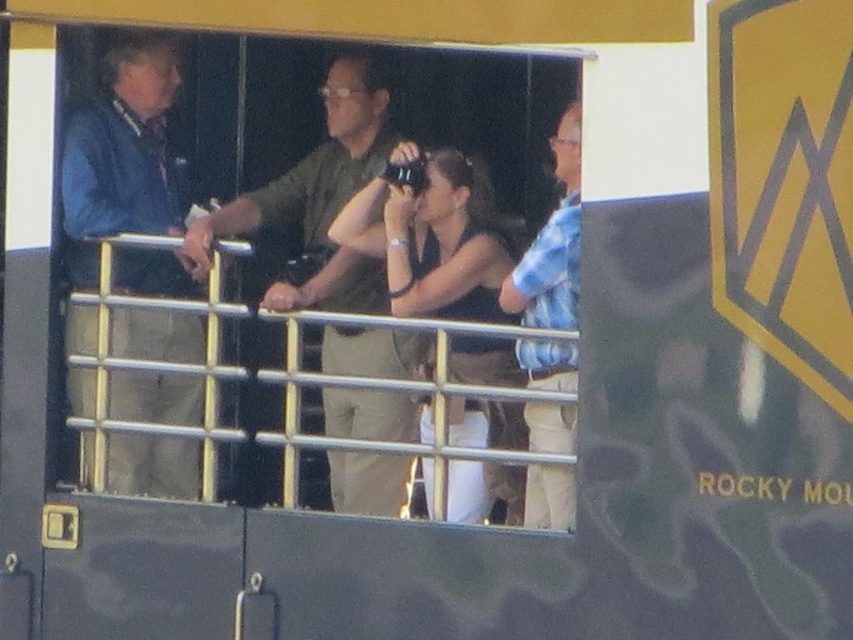
You are a person standing on the balcony and want to look through the transparent glass at center without disturbing the blue fabric jacket at left. Which object should you move closer to?

You should move closer to the transparent glass at center because it is already closer to the viewer than the blue fabric jacket at left, so you can reach it without needing to move the jacket.

You are standing on a balcony with a group of people. You see a green matte shirt at center and a black matte tank top at center. Which person is positioned to the left of the other?

The green matte shirt at center is to the left of the black matte tank top at center.

You are a photographer positioned behind the group and want to capture a clear shot of the black matte tank top at center without the blue fabric jacket at left obstructing the view. Is this possible given their positions?

The blue fabric jacket at left is further to the viewer than the black matte tank top at center, so it would block the view of the black matte tank top at center. Therefore, capturing a clear shot without obstruction is not possible.